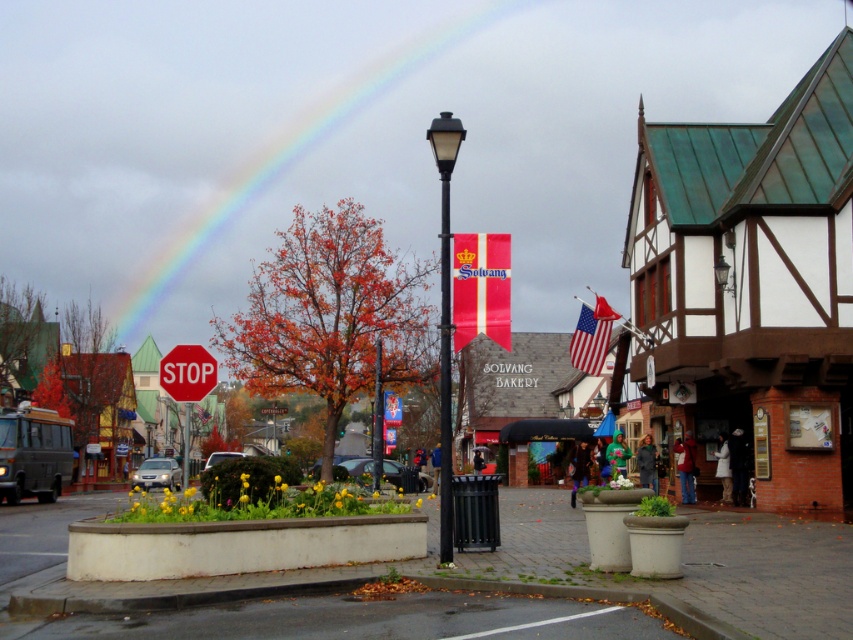
You are a tourist in Solvang, California, and you see the rainbow at upper center and the american flag at center. Which object is higher in the sky?

The rainbow at upper center is higher in the sky than the american flag at center because it is located above it.

You are a pedestrian standing at the corner of the street where the round planter with yellow flowers is located. You want to walk straight ahead towards the red matte stop sign at center. There is a red fabric banner at center hanging above the path. Can you walk under the banner without needing to duck?

The red fabric banner at center and red matte stop sign at center are 10.85 meters apart, so the distance between them is sufficient for a pedestrian to walk under the banner without needing to duck, as the banner is likely positioned at a standard height above the ground.